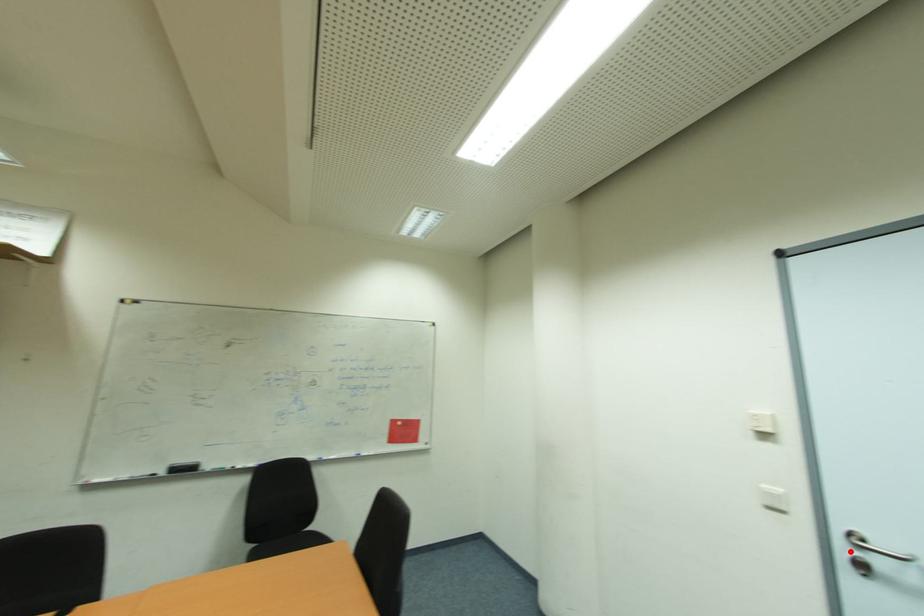
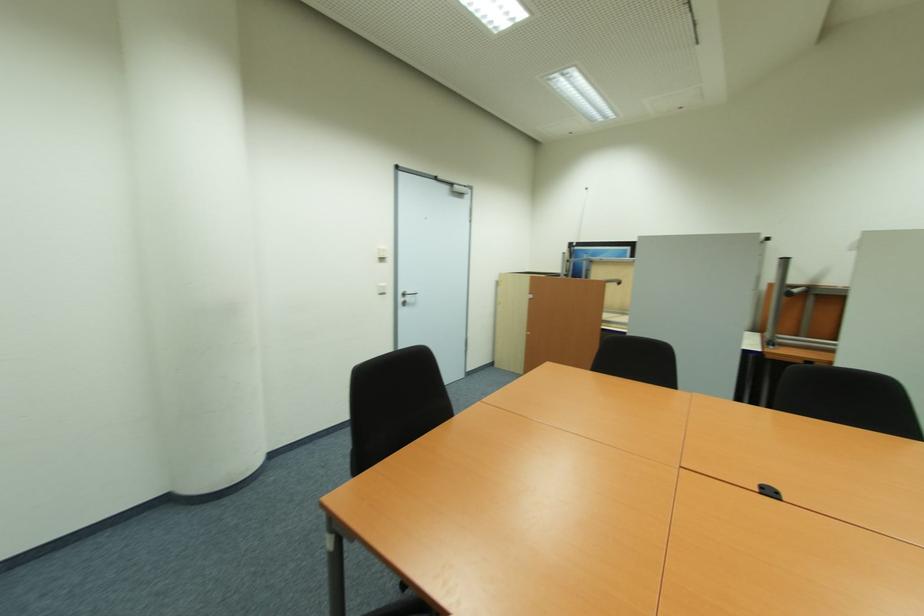
Locate, in the second image, the point that corresponds to the highlighted location in the first image.

(405, 300)